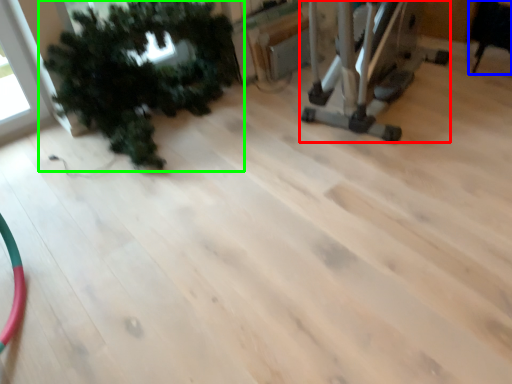
Question: Based on their relative distances, which object is farther from equipment (highlighted by a red box)? Choose from chair (highlighted by a blue box) and houseplant (highlighted by a green box).

Choices:
 (A) chair
 (B) houseplant

Answer: (B)